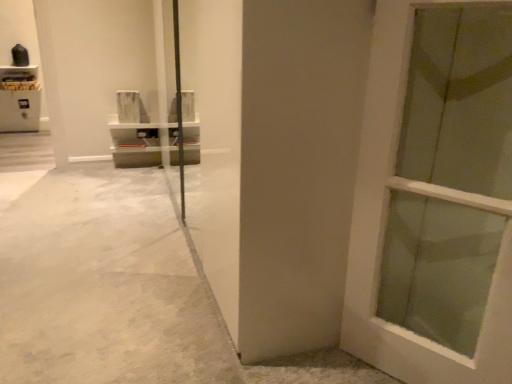
Question: Is white matte door at center turned away from wooden shelf at upper left?

Choices:
 (A) yes
 (B) no

Answer: (B)

Question: Is white matte door at center at the left side of wooden shelf at upper left?

Choices:
 (A) yes
 (B) no

Answer: (B)

Question: Would you say white matte door at center is outside wooden shelf at upper left?

Choices:
 (A) yes
 (B) no

Answer: (A)

Question: Can you confirm if white matte door at center is wider than wooden shelf at upper left?

Choices:
 (A) no
 (B) yes

Answer: (A)

Question: Is white matte door at center touching wooden shelf at upper left?

Choices:
 (A) yes
 (B) no

Answer: (B)

Question: Does white matte door at center have a lesser height compared to wooden shelf at upper left?

Choices:
 (A) yes
 (B) no

Answer: (B)

Question: From a real-world perspective, is white polished concrete at center over white matte door at center?

Choices:
 (A) no
 (B) yes

Answer: (A)

Question: From the image's perspective, is white polished concrete at center on white matte door at center?

Choices:
 (A) no
 (B) yes

Answer: (A)

Question: Is white polished concrete at center placed right next to white matte door at center?

Choices:
 (A) no
 (B) yes

Answer: (A)

Question: Is white matte door at center located within white polished concrete at center?

Choices:
 (A) no
 (B) yes

Answer: (A)

Question: From a real-world perspective, is white polished concrete at center physically below white matte door at center?

Choices:
 (A) yes
 (B) no

Answer: (A)

Question: Is white polished concrete at center located outside white matte door at center?

Choices:
 (A) yes
 (B) no

Answer: (A)

Question: Can we say wooden shelf at upper left lies outside white matte door at center?

Choices:
 (A) no
 (B) yes

Answer: (B)